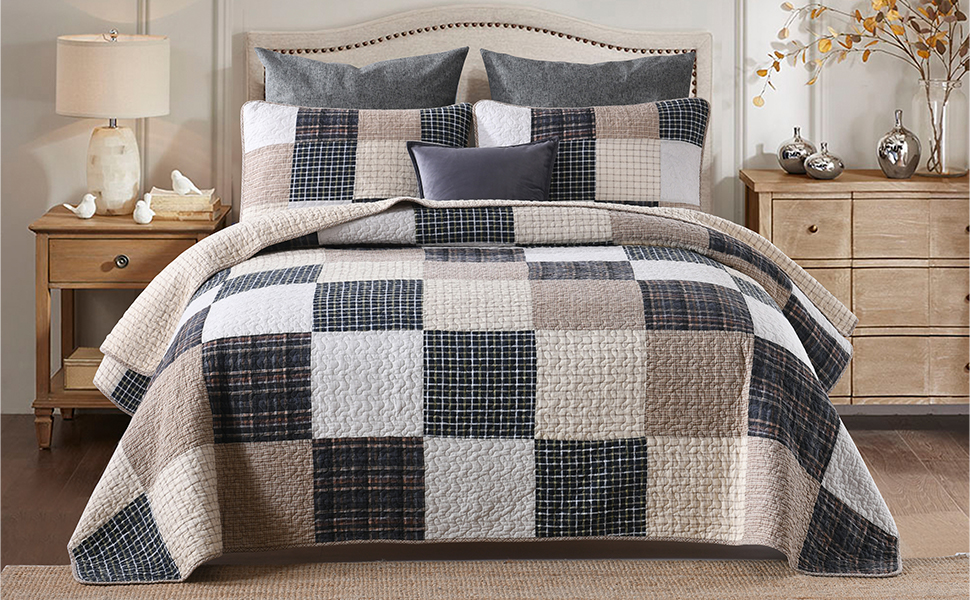
I want to click on black pillow, so click(531, 165).